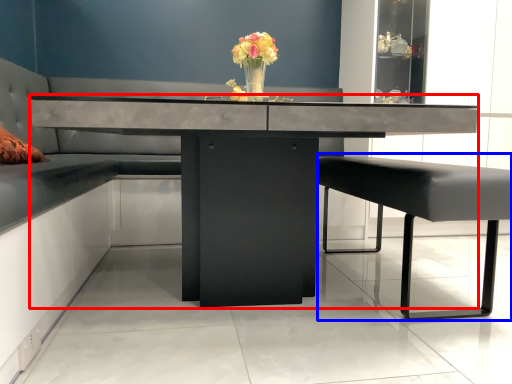
Question: Which object appears closest to the camera in this image, table (highlighted by a red box) or swivel chair (highlighted by a blue box)?

Choices:
 (A) table
 (B) swivel chair

Answer: (A)